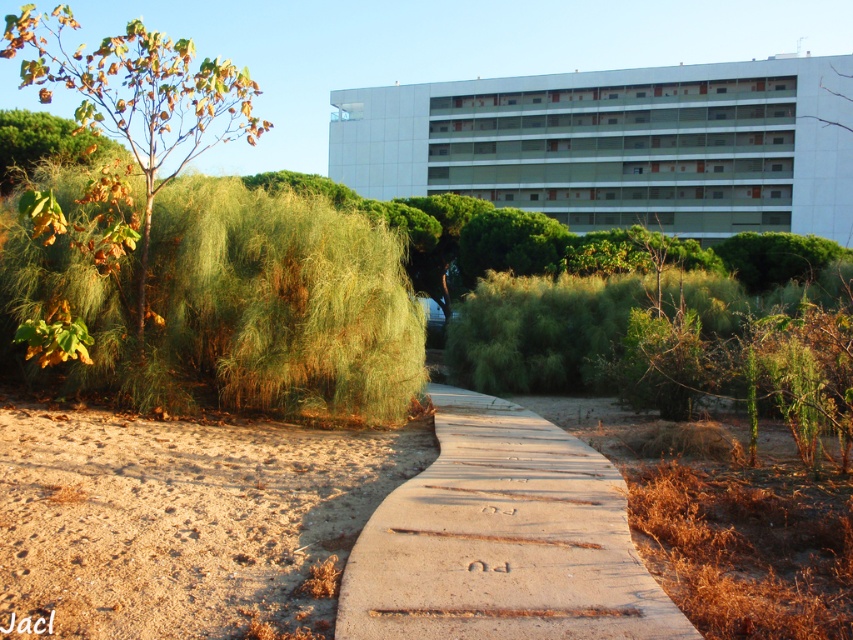
Between wooden at center and brown leafy tree at left, which one is positioned higher?

Positioned higher is brown leafy tree at left.

Who is shorter, wooden at center or brown leafy tree at left?

Standing shorter between the two is wooden at center.

The width and height of the screenshot is (853, 640). I want to click on wooden at center, so click(x=502, y=540).

Between white smooth building at upper center and brown leafy tree at left, which one appears on the left side from the viewer's perspective?

brown leafy tree at left

Does white smooth building at upper center have a greater width compared to brown leafy tree at left?

No.

Image resolution: width=853 pixels, height=640 pixels. Describe the element at coordinates (618, 145) in the screenshot. I see `white smooth building at upper center` at that location.

Find the location of a particular element. white smooth building at upper center is located at coordinates (618, 145).

Does green grassy hedge at left have a lesser width compared to wooden at center?

Incorrect, green grassy hedge at left's width is not less than wooden at center's.

Does green grassy hedge at left come behind wooden at center?

That is True.

Does point (1, 280) lie behind point (456, 628)?

Yes, it is.

Identify the location of green grassy hedge at left. pos(213,298).